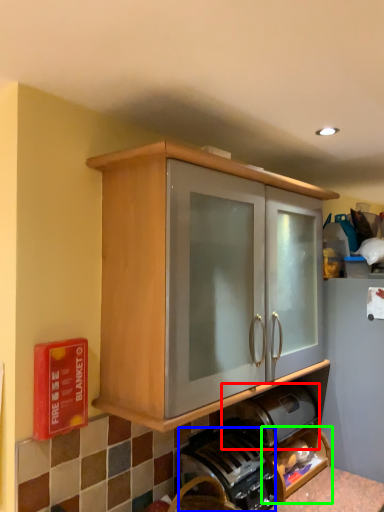
Question: Which object is the farthest from appliance (highlighted by a red box)? Choose among these: coffee machine (highlighted by a blue box) or shelf (highlighted by a green box).

Choices:
 (A) coffee machine
 (B) shelf

Answer: (A)